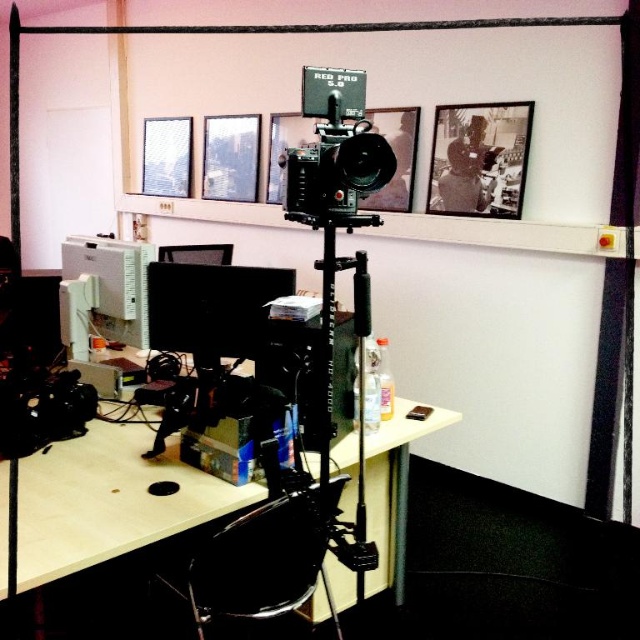
Question: Which point is closer to the camera?

Choices:
 (A) matte black monitor at center
 (B) metallic silver picture frame at upper center
 (C) black plastic swivel chair at center
 (D) metallic silver picture frame at upper left

Answer: (C)

Question: Which object is farther from the camera taking this photo?

Choices:
 (A) matte black desk at center
 (B) black plastic swivel chair at center

Answer: (B)

Question: Does black matte picture frame at upper center have a larger size compared to metallic silver picture frame at upper center?

Choices:
 (A) yes
 (B) no

Answer: (B)

Question: Is matte black monitor at center closer to the viewer compared to metallic silver picture frame at upper left?

Choices:
 (A) no
 (B) yes

Answer: (B)

Question: Among these points, which one is farthest from the camera?

Choices:
 (A) (374, 196)
 (B) (182, 266)
 (C) (289, 545)
 (D) (116, 500)

Answer: (A)

Question: Can you confirm if matte black desk at center is thinner than black matte picture frame at upper center?

Choices:
 (A) no
 (B) yes

Answer: (A)